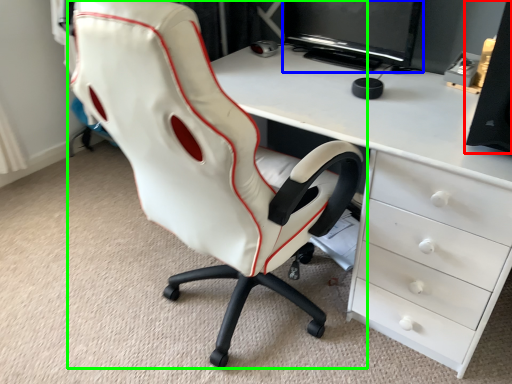
Question: Estimate the real-world distances between objects in this image. Which object is closer to speaker (highlighted by a red box), computer monitor (highlighted by a blue box) or chair (highlighted by a green box)?

Choices:
 (A) computer monitor
 (B) chair

Answer: (B)